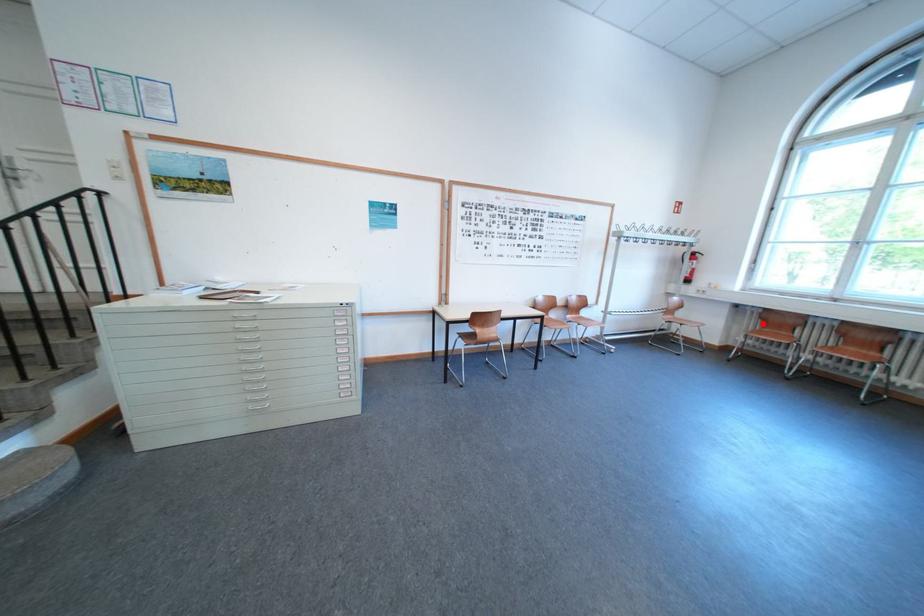
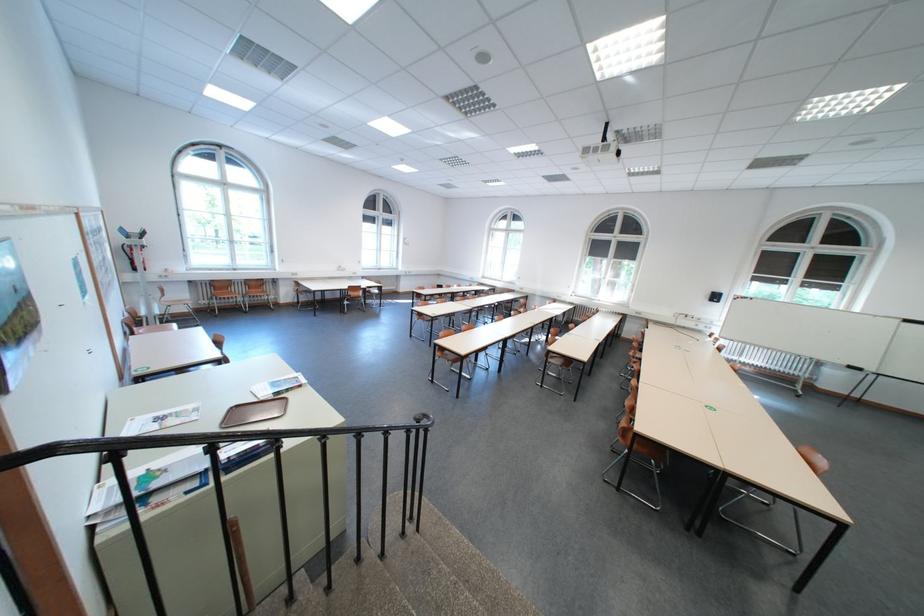
Locate, in the second image, the point that corresponds to the highlighted location in the first image.

(219, 292)